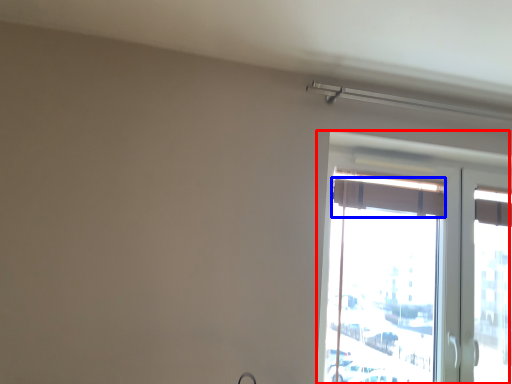
Question: Which object is further to the camera taking this photo, window (highlighted by a red box) or curtain (highlighted by a blue box)?

Choices:
 (A) window
 (B) curtain

Answer: (B)